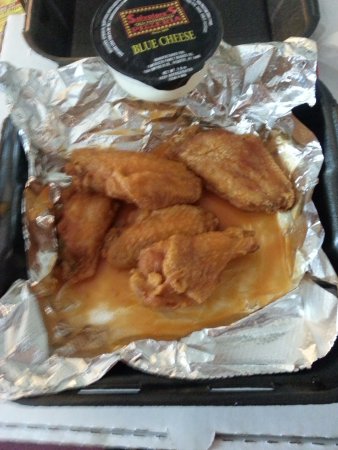
At what (x,y) coordinates should I click in order to perform the action: click on plastic container. Please return your answer as a coordinate pair (x, y). The height and width of the screenshot is (450, 338). Looking at the image, I should click on (296, 385).